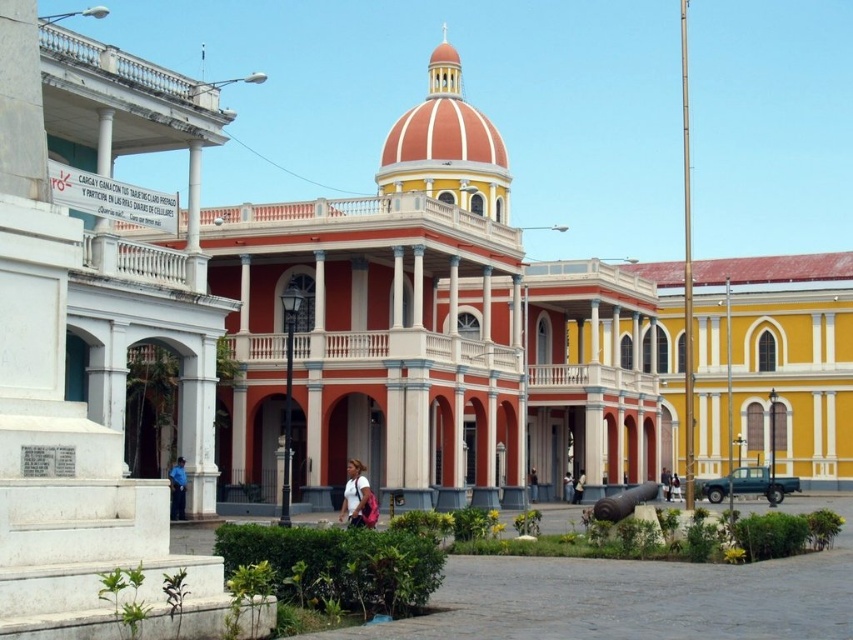
Question: Which point is farther to the camera?

Choices:
 (A) (173, 467)
 (B) (676, 480)

Answer: (B)

Question: Which object appears closest to the camera in this image?

Choices:
 (A) light brown leather chair at center
 (B) dark blue jeans at center
 (C) light blue fabric shirt at center
 (D) matte red building at center

Answer: (D)

Question: Does dark blue jeans at center come in front of white fabric shirt at center?

Choices:
 (A) yes
 (B) no

Answer: (A)

Question: Is light brown leather chair at center wider than light blue fabric shirt at center?

Choices:
 (A) yes
 (B) no

Answer: (A)

Question: Which point is closer to the camera?

Choices:
 (A) (183, 486)
 (B) (357, 499)
 (C) (666, 472)
 (D) (570, 490)

Answer: (B)

Question: Does dark blue jeans at center appear under light blue fabric shirt at center?

Choices:
 (A) no
 (B) yes

Answer: (A)